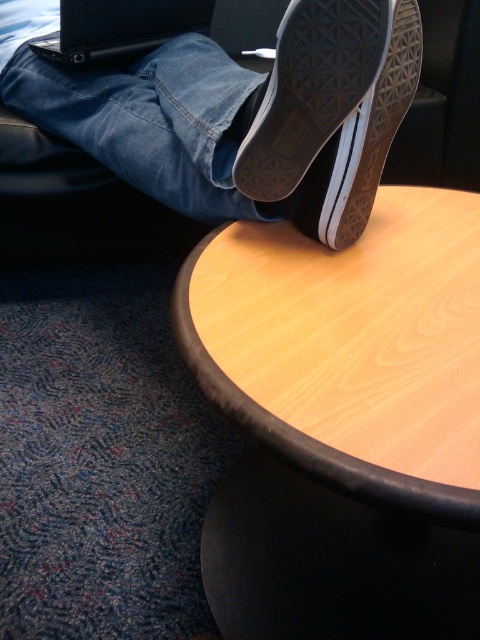
Based on the scene description, what object is located at the coordinates point (349, 346)?

The point (349, 346) indicates the wooden table at upper center.

You are trying to place a 12 inch by 12 inch square coaster on the wooden table at upper center. Based on the scene description, will it fit on the table?

The wooden table at upper center is 14.49 inches away from the camera, but this distance does not indicate the table size. The coaster size cannot be determined from the given information.

You are a robot trying to place a new object on the table. The table has a coordinate system where the bottom left corner is the origin. The black canvas shoe at upper center is already placed at point (310, 90). If you want to place a new object 0.2 units to the right and 0.1 units down from the black canvas shoe at upper center, what would be the new coordinates?

The new coordinates would be calculated by adding 0.2 to the x coordinate and subtracting 0.1 from the y coordinate of the black canvas shoe at upper center. The original coordinates are (310, 90). Adding 0.2 to the x gives 0.341, and subtracting 0.1 from the y gives 0.546. Therefore, the new coordinates are 0.341, 0.546.